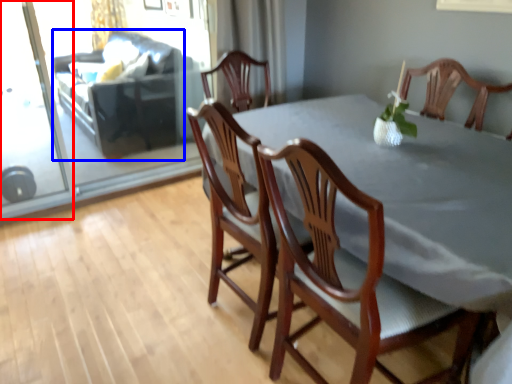
Question: Which point is further to the camera, screen door (highlighted by a red box) or couch (highlighted by a blue box)?

Choices:
 (A) screen door
 (B) couch

Answer: (B)